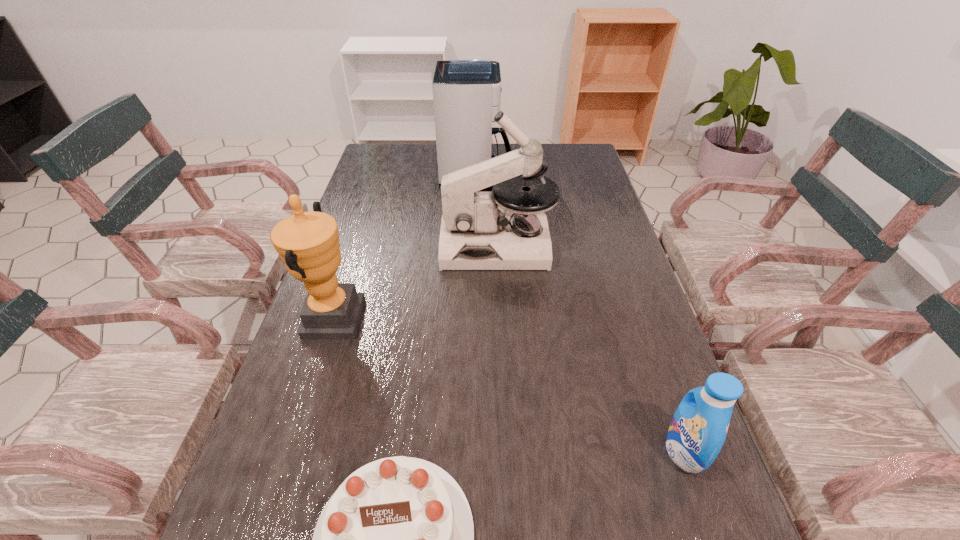
In order to click on free space at the far left corner in this screenshot , I will do `click(369, 157)`.

Find the location of `vacant space at the far right corner of the desktop`. vacant space at the far right corner of the desktop is located at coordinates (573, 147).

This screenshot has height=540, width=960. Find the location of `vacant area that lies between the fourth tallest object and the coffee maker`. vacant area that lies between the fourth tallest object and the coffee maker is located at coordinates (580, 314).

Find the location of a particular element. empty location between the third nearest object and the farthest object is located at coordinates [x=405, y=248].

The width and height of the screenshot is (960, 540). What are the coordinates of `blank region between the rightmost object and the coffee maker` in the screenshot? It's located at (580, 314).

Where is `empty location between the second farthest object and the fourth tallest object`? empty location between the second farthest object and the fourth tallest object is located at coordinates (590, 348).

The image size is (960, 540). Find the location of `object that stands as the second closest to the microscope`. object that stands as the second closest to the microscope is located at coordinates (307, 242).

Identify which object is the second nearest to the shortest object. Please provide its 2D coordinates. Your answer should be formatted as a tuple, i.e. [(x, y)], where the tuple contains the x and y coordinates of a point satisfying the conditions above.

[(698, 429)]